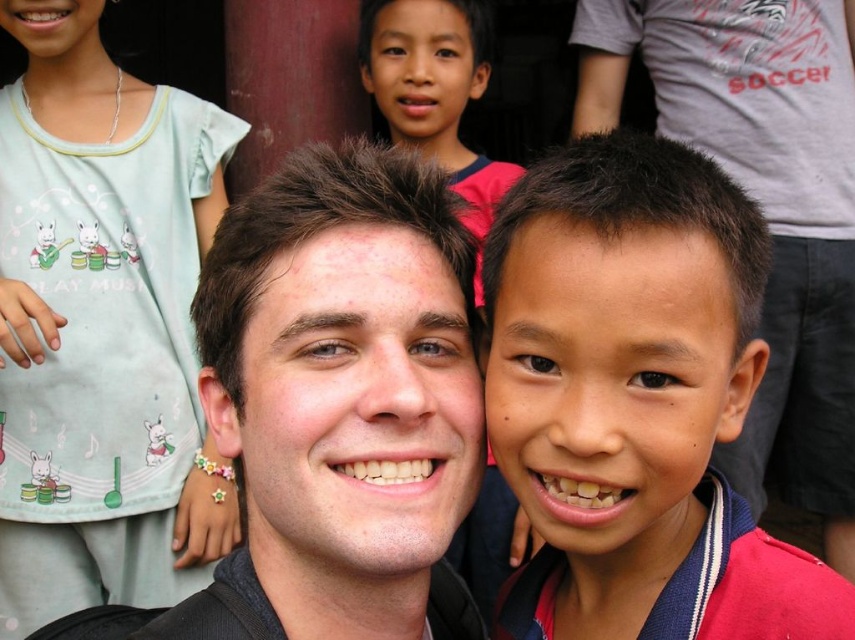
Is point (355, 147) positioned in front of point (441, 122)?

Yes, point (355, 147) is in front of point (441, 122).

This screenshot has width=855, height=640. I want to click on matte black hair at center, so click(335, 406).

The width and height of the screenshot is (855, 640). What do you see at coordinates (635, 401) in the screenshot?
I see `smooth skin boy at center` at bounding box center [635, 401].

Can you confirm if smooth skin boy at center is positioned to the right of light blue fabric shirt at upper left?

Correct, you'll find smooth skin boy at center to the right of light blue fabric shirt at upper left.

Who is more forward, [541,554] or [155,356]?

Point [541,554]

Find the location of `smooth skin boy at center`. smooth skin boy at center is located at coordinates (635, 401).

Does matte black hair at center have a greater height compared to light blue fabric shirt at upper left?

Incorrect, matte black hair at center's height is not larger of light blue fabric shirt at upper left's.

Can you confirm if matte black hair at center is bigger than light blue fabric shirt at upper left?

No, matte black hair at center is not bigger than light blue fabric shirt at upper left.

Is point (441, 326) farther from viewer compared to point (62, 316)?

No, it is in front of (62, 316).

At what (x,y) coordinates should I click in order to perform the action: click on matte black hair at center. Please return your answer as a coordinate pair (x, y). The image size is (855, 640). Looking at the image, I should click on (335, 406).